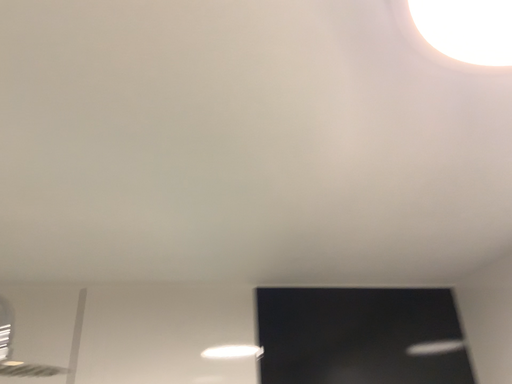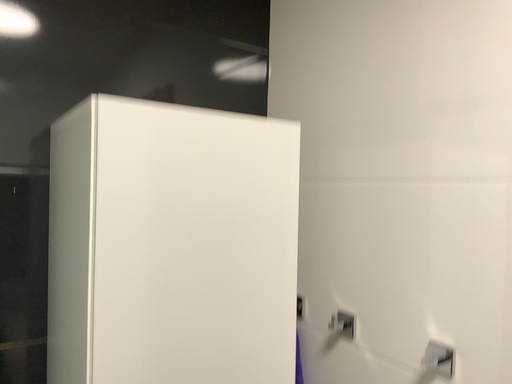
Question: Which way did the camera rotate in the video?

Choices:
 (A) rotated downward
 (B) rotated upward

Answer: (A)